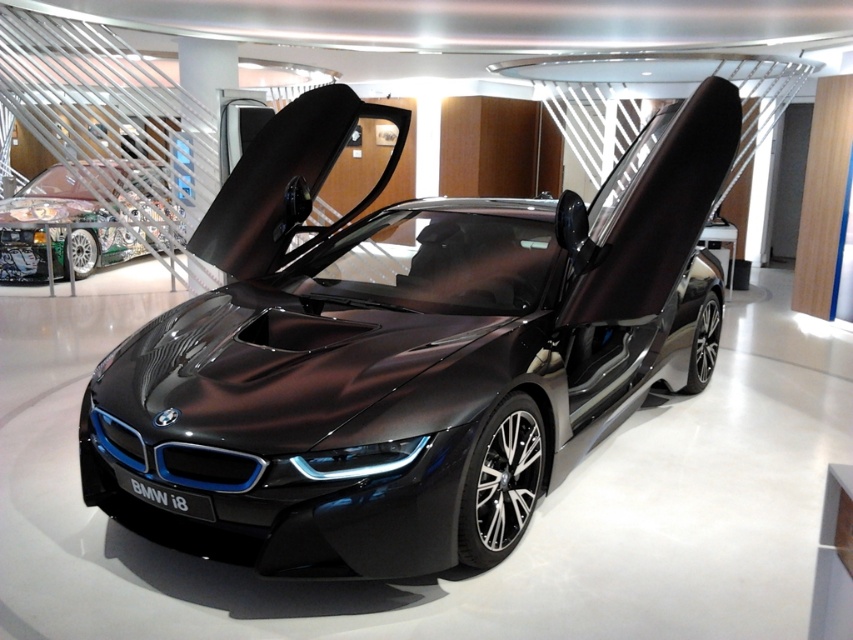
You are standing in front of the BMW i8 sports car and notice two points marked on its body. The first point is at coordinate point (x=471, y=333) and the second is at point (x=35, y=244). If you were to touch both points with your hand, which point would feel closer to your body?

Point (x=471, y=333) is closer to the viewer than point (x=35, y=244), so touching point (x=471, y=333) would feel closer to your body.

You are a photographer setting up a shoot for a car magazine. You need to position a light source to highlight both the glossy metallic car at center and the shiny metallic race car at left. Considering their heights, where should you place the light to ensure both cars are evenly illuminated?

The glossy metallic car at center is much taller than the shiny metallic race car at left. To ensure both are evenly illuminated, position the light higher above the taller car so the light can reach both vehicles effectively without casting harsh shadows on the shorter one.

You are a photographer planning to take a photo of the glossy metallic car at center and the shiny metallic race car at left. If you want to ensure both cars are clearly visible in the frame, which car should you focus on first to maintain proper focus, considering their sizes?

The glossy metallic car at center is larger in size than the shiny metallic race car at left, so you should focus on the glossy metallic car at center first to ensure proper focus, as it occupies more space in the frame.